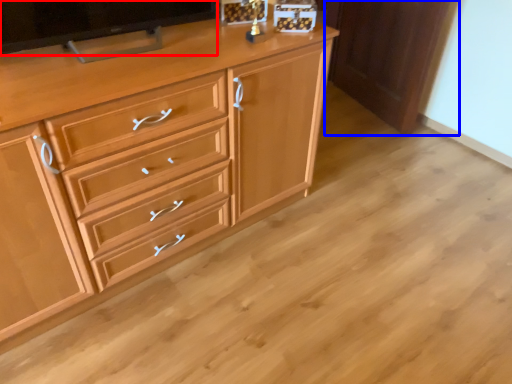
Question: Among these objects, which one is farthest to the camera, television (highlighted by a red box) or cabinetry (highlighted by a blue box)?

Choices:
 (A) television
 (B) cabinetry

Answer: (B)